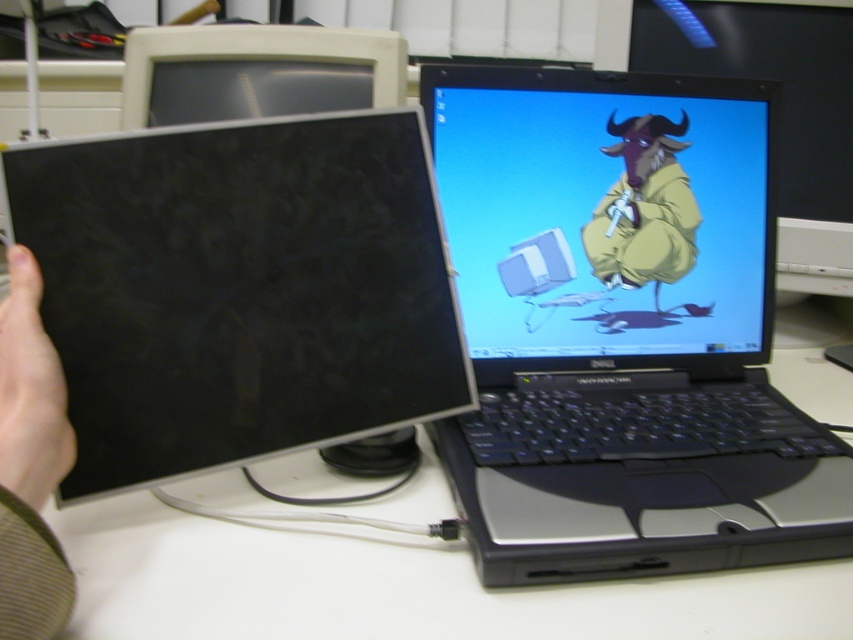
Question: Among these objects, which one is nearest to the camera?

Choices:
 (A) matte black monitor at center
 (B) black matte computer monitor at left
 (C) yellow matte jacket at center
 (D) matte plastic monitor at upper left

Answer: (B)

Question: Which point appears farthest from the camera in this image?

Choices:
 (A) (405, 67)
 (B) (525, 122)

Answer: (A)

Question: Is black matte computer monitor at left bigger than matte black monitor at center?

Choices:
 (A) yes
 (B) no

Answer: (A)

Question: Does matte black monitor at center have a smaller size compared to yellow matte jacket at center?

Choices:
 (A) no
 (B) yes

Answer: (A)

Question: Which point is closer to the camera?

Choices:
 (A) matte black monitor at center
 (B) yellow matte jacket at center

Answer: (A)

Question: Does black matte computer monitor at left have a larger size compared to white matte computer desk at center?

Choices:
 (A) no
 (B) yes

Answer: (A)